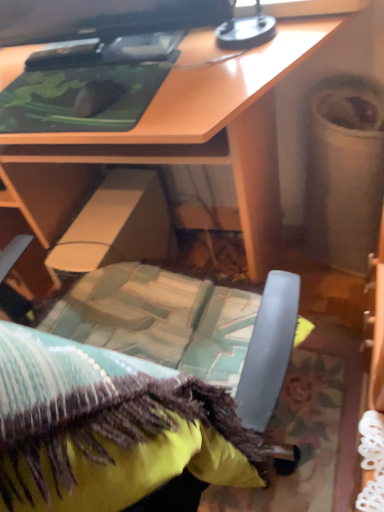
Question: Should I look upward or downward to see black glossy monitor at upper center?

Choices:
 (A) down
 (B) up

Answer: (B)